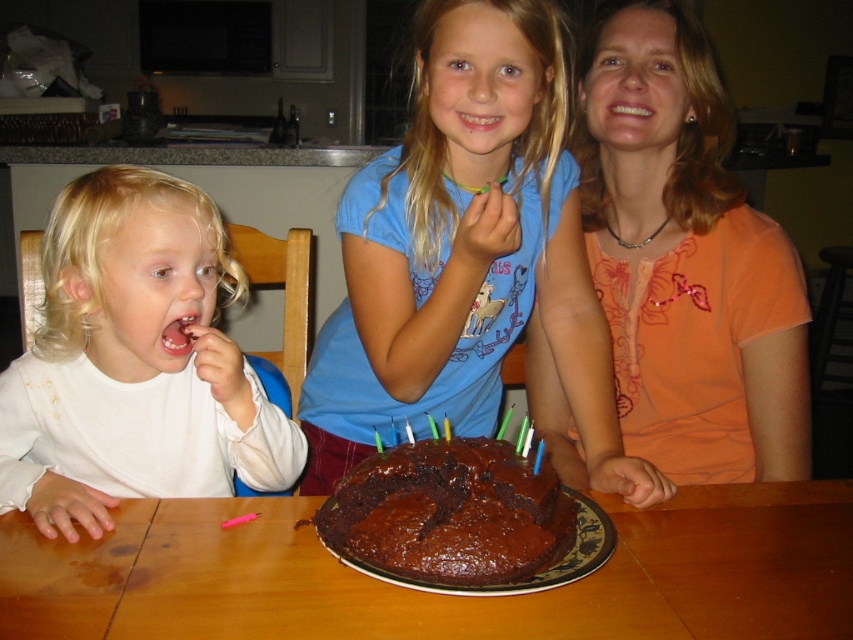
Is brown wooden table at center to the left of white matte shirt at left from the viewer's perspective?

No, brown wooden table at center is not to the left of white matte shirt at left.

Between point (809, 632) and point (236, 291), which one is positioned behind?

The point (236, 291) is more distant.

This screenshot has width=853, height=640. Identify the location of brown wooden table at center. (437, 595).

Between matte chocolate cake at center and brown wooden table at center, which one has less height?

brown wooden table at center

Is matte chocolate cake at center taller than brown wooden table at center?

Correct, matte chocolate cake at center is much taller as brown wooden table at center.

Who is more forward, (x=445, y=394) or (x=326, y=582)?

Point (x=326, y=582) is more forward.

Locate an element on the screen. This screenshot has width=853, height=640. matte chocolate cake at center is located at coordinates (467, 253).

Does white matte shirt at left have a smaller size compared to chocolate matte cake at center?

Incorrect, white matte shirt at left is not smaller in size than chocolate matte cake at center.

Is white matte shirt at left positioned behind chocolate matte cake at center?

Yes, it is behind chocolate matte cake at center.

You are a GUI agent. You are given a task and a screenshot of the screen. Output one action in this format:
    pyautogui.click(x=<x>, y=<y>)
    Task: Click on the white matte shirt at left
    
    Given the screenshot: What is the action you would take?
    pyautogui.click(x=134, y=362)

At what (x,y) coordinates should I click in order to perform the action: click on white matte shirt at left. Please return your answer as a coordinate pair (x, y). Looking at the image, I should click on (134, 362).